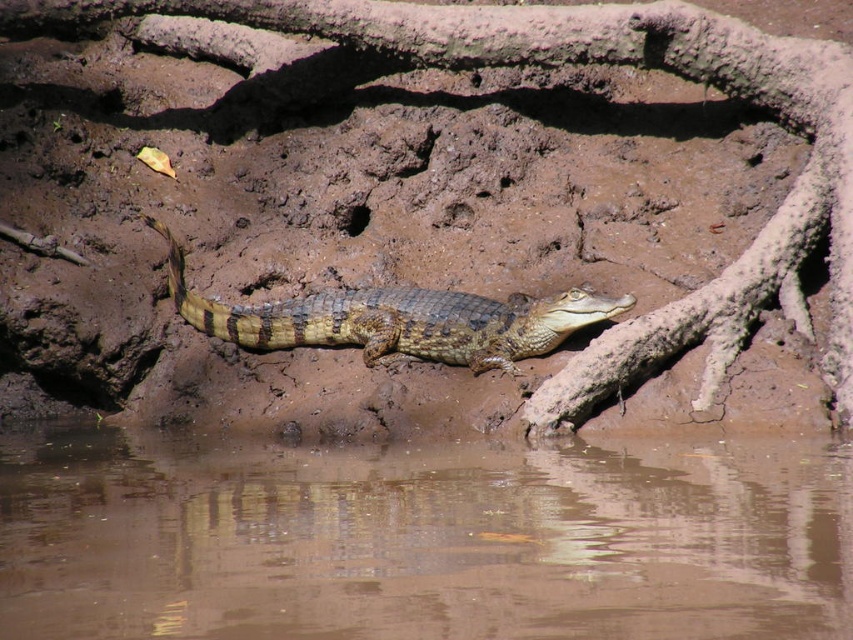
Question: Which object is the farthest from the brown scaly crocodile at center?

Choices:
 (A) brown mud at center
 (B) brown muddy water at lower center

Answer: (B)

Question: Is brown mud at center thinner than brown scaly crocodile at center?

Choices:
 (A) yes
 (B) no

Answer: (B)

Question: Among these objects, which one is farthest from the camera?

Choices:
 (A) brown muddy water at lower center
 (B) brown scaly crocodile at center
 (C) brown mud at center

Answer: (B)

Question: In this image, where is brown muddy water at lower center located relative to brown mud at center?

Choices:
 (A) below
 (B) above

Answer: (A)

Question: Does brown mud at center lie behind brown scaly crocodile at center?

Choices:
 (A) no
 (B) yes

Answer: (A)

Question: Which of these objects is positioned farthest from the brown muddy water at lower center?

Choices:
 (A) brown mud at center
 (B) brown scaly crocodile at center

Answer: (A)